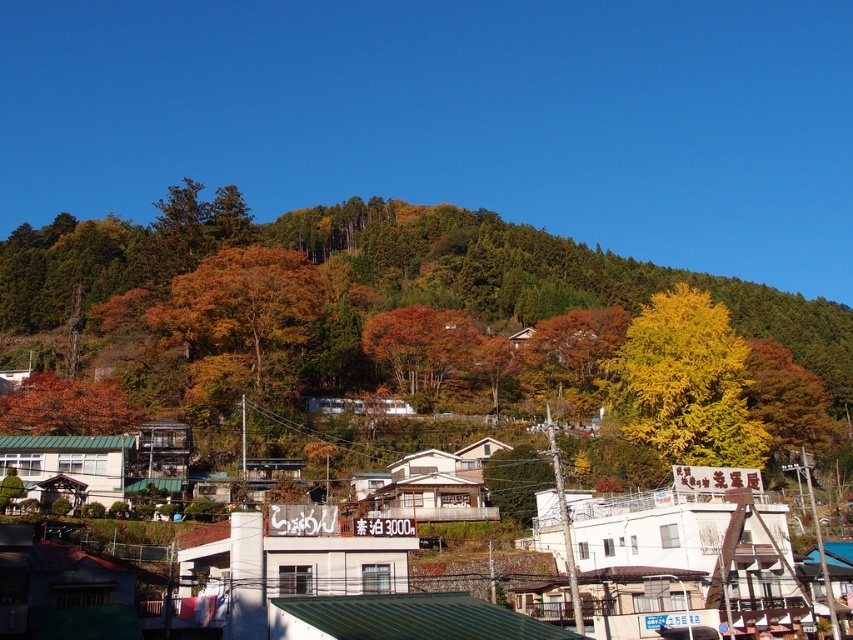
Between point (587, 356) and point (117, 412), which one is positioned in front?

Point (117, 412) is in front.

Find the location of a particular element. The width and height of the screenshot is (853, 640). yellow/golden leaves at upper center is located at coordinates (399, 323).

Does yellow/golden/yellowish-green leafy tree at center-right have a greater width compared to orange matte tree at lower left?

In fact, yellow/golden/yellowish-green leafy tree at center-right might be narrower than orange matte tree at lower left.

Which is below, yellow/golden/yellowish-green leafy tree at center-right or orange matte tree at lower left?

orange matte tree at lower left is lower down.

Which is behind, point (699, 394) or point (126, 404)?

The point (126, 404) is more distant.

What are the coordinates of `yellow/golden/yellowish-green leafy tree at center-right` in the screenshot? It's located at (685, 384).

Is point (607, 257) positioned behind point (714, 317)?

Yes, point (607, 257) is farther from viewer.

Is point (403, 221) positioned in front of point (676, 298)?

No, (403, 221) is further to viewer.

Is point (587, 397) less distant than point (695, 404)?

No, (587, 397) is further to viewer.

You are a GUI agent. You are given a task and a screenshot of the screen. Output one action in this format:
    pyautogui.click(x=<x>, y=<y>)
    Task: Click on the yellow/golden leaves at upper center
    This screenshot has height=640, width=853.
    Given the screenshot: What is the action you would take?
    pyautogui.click(x=399, y=323)